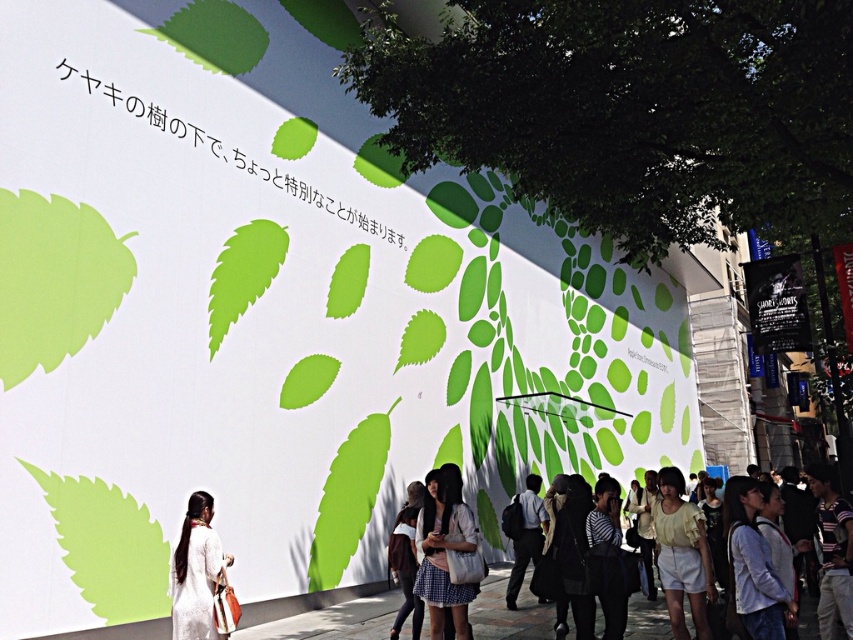
Does concrete pavement at lower center have a greater width compared to dark gray wool coat at center?

Yes.

Does concrete pavement at lower center lie in front of dark gray wool coat at center?

No, it is behind dark gray wool coat at center.

Which is in front, point (480, 600) or point (558, 612)?

Point (558, 612) is in front.

Locate an element on the screen. concrete pavement at lower center is located at coordinates (332, 621).

From the picture: Is concrete pavement at lower center wider than matte white dress at lower center?

Yes.

What do you see at coordinates (332, 621) in the screenshot? I see `concrete pavement at lower center` at bounding box center [332, 621].

Describe the element at coordinates (332, 621) in the screenshot. This screenshot has height=640, width=853. I see `concrete pavement at lower center` at that location.

What are the coordinates of `concrete pavement at lower center` in the screenshot? It's located at coord(332,621).

Is light blue denim jacket at lower right to the right of silky white dress at lower left from the viewer's perspective?

Indeed, light blue denim jacket at lower right is positioned on the right side of silky white dress at lower left.

The height and width of the screenshot is (640, 853). Describe the element at coordinates (753, 564) in the screenshot. I see `light blue denim jacket at lower right` at that location.

The image size is (853, 640). In order to click on light blue denim jacket at lower right in this screenshot , I will do `click(753, 564)`.

The width and height of the screenshot is (853, 640). Identify the location of light blue denim jacket at lower right. (753, 564).